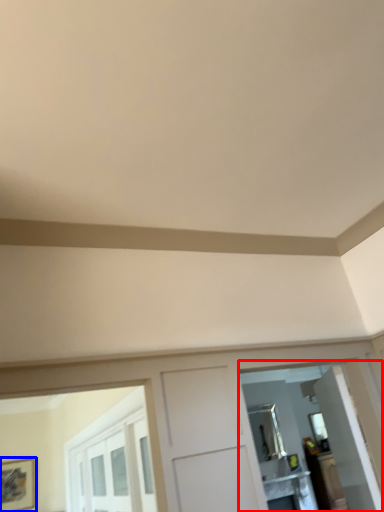
Question: Among these objects, which one is farthest to the camera, mirror (highlighted by a red box) or picture frame (highlighted by a blue box)?

Choices:
 (A) mirror
 (B) picture frame

Answer: (B)